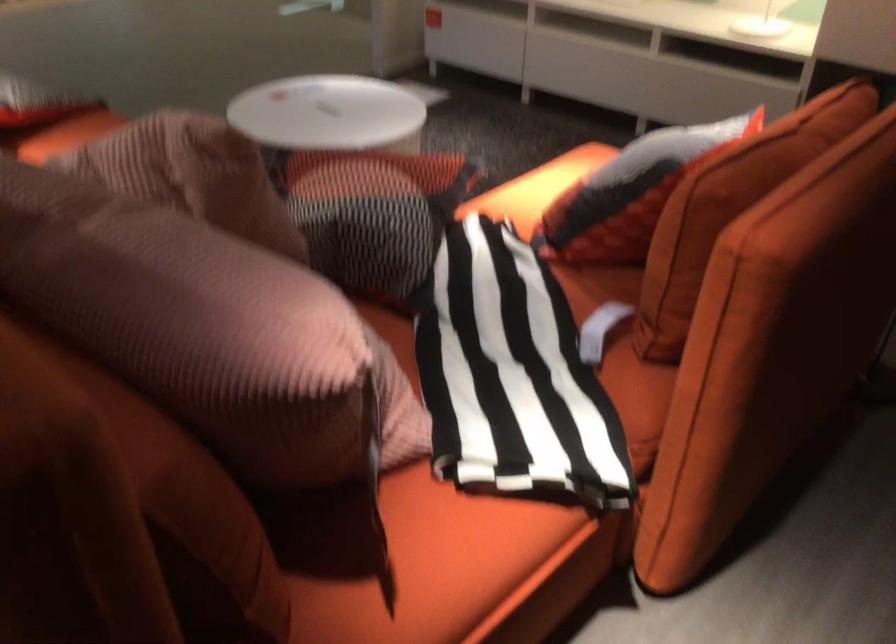
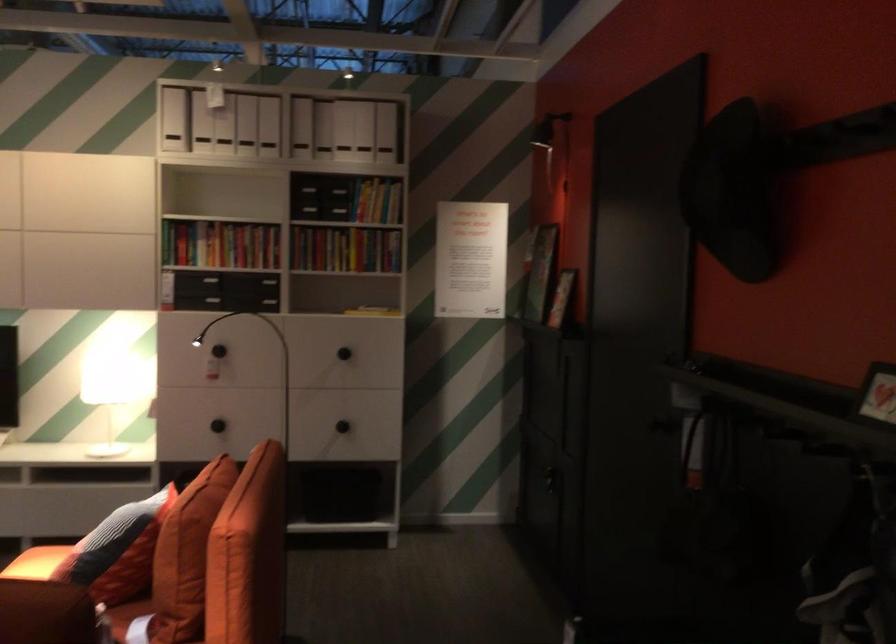
Where in the second image is the point corresponding to pixel 691 242 from the first image?

(186, 554)